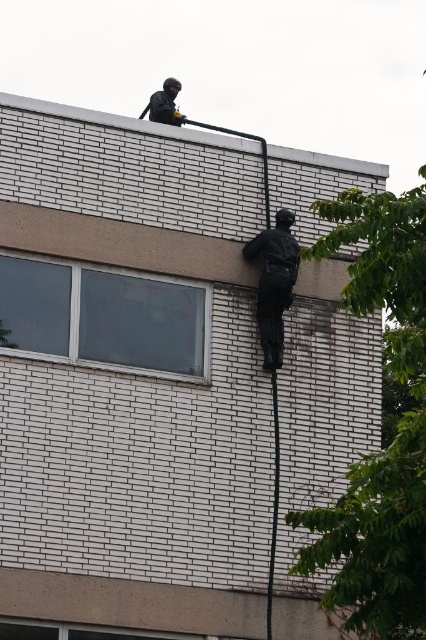
Question: Which of these objects is positioned closest to the black matte helmet at upper center?

Choices:
 (A) transparent glass window at center
 (B) matte black figure at center

Answer: (B)

Question: Can you confirm if transparent glass window at center is positioned to the right of black matte helmet at upper center?

Choices:
 (A) no
 (B) yes

Answer: (A)

Question: Can you confirm if white brick wall at upper center is smaller than matte black figure at center?

Choices:
 (A) yes
 (B) no

Answer: (B)

Question: Is transparent glass window at center below black matte helmet at upper center?

Choices:
 (A) no
 (B) yes

Answer: (B)

Question: Based on their relative distances, which object is farther from the clear glass window at lower left?

Choices:
 (A) transparent glass window at center
 (B) white brick wall at upper center
 (C) black matte helmet at upper center

Answer: (C)

Question: Which of these objects is positioned farthest from the transparent glass window at center?

Choices:
 (A) matte black figure at center
 (B) clear glass window at lower left
 (C) black matte helmet at upper center
 (D) white brick wall at upper center

Answer: (C)